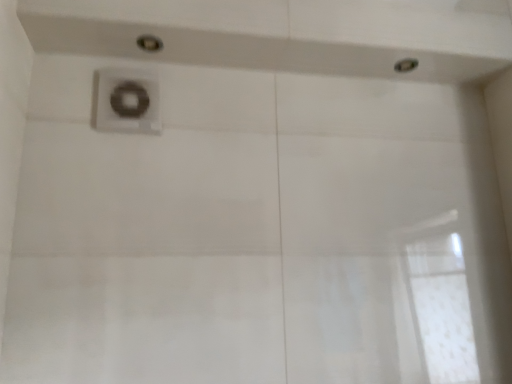
Question: Is metallic silver showerhead at upper right, which is the 1th shower in right-to-left order, to the left of satin nickel faucet at upper center from the viewer's perspective?

Choices:
 (A) yes
 (B) no

Answer: (B)

Question: Does metallic silver showerhead at upper right, arranged as the second shower when viewed from the left, have a smaller size compared to satin nickel faucet at upper center?

Choices:
 (A) no
 (B) yes

Answer: (B)

Question: Is metallic silver showerhead at upper right, which is the 1th shower in right-to-left order, positioned with its back to satin nickel faucet at upper center?

Choices:
 (A) no
 (B) yes

Answer: (A)

Question: Could you tell me if metallic silver showerhead at upper right, which is the 2th shower from front to back, is turned towards satin nickel faucet at upper center?

Choices:
 (A) yes
 (B) no

Answer: (B)

Question: Is metallic silver showerhead at upper right, the first shower in the back-to-front sequence, surrounding satin nickel faucet at upper center?

Choices:
 (A) no
 (B) yes

Answer: (A)

Question: Is metallic silver showerhead at upper right, arranged as the second shower when viewed from the left, at the right side of satin nickel faucet at upper center?

Choices:
 (A) no
 (B) yes

Answer: (B)

Question: From a real-world perspective, is satin nickel faucet at upper center physically below matte silver shower at upper center, which ranks as the second shower in right-to-left order?

Choices:
 (A) yes
 (B) no

Answer: (A)

Question: Could you tell me if satin nickel faucet at upper center is facing matte silver shower at upper center, the first shower from the left?

Choices:
 (A) no
 (B) yes

Answer: (A)

Question: From the image's perspective, is satin nickel faucet at upper center under matte silver shower at upper center, positioned as the 2th shower in back-to-front order?

Choices:
 (A) no
 (B) yes

Answer: (B)

Question: From the image's perspective, is satin nickel faucet at upper center on matte silver shower at upper center, placed as the 1th shower when sorted from front to back?

Choices:
 (A) no
 (B) yes

Answer: (A)

Question: Considering the relative positions of satin nickel faucet at upper center and matte silver shower at upper center, positioned as the 2th shower in back-to-front order, in the image provided, is satin nickel faucet at upper center to the right of matte silver shower at upper center, positioned as the 2th shower in back-to-front order, from the viewer's perspective?

Choices:
 (A) no
 (B) yes

Answer: (A)

Question: Is matte silver shower at upper center, positioned as the 2th shower in back-to-front order, located within satin nickel faucet at upper center?

Choices:
 (A) no
 (B) yes

Answer: (A)

Question: Is satin nickel faucet at upper center positioned in front of metallic silver showerhead at upper right, arranged as the second shower when viewed from the left?

Choices:
 (A) no
 (B) yes

Answer: (B)